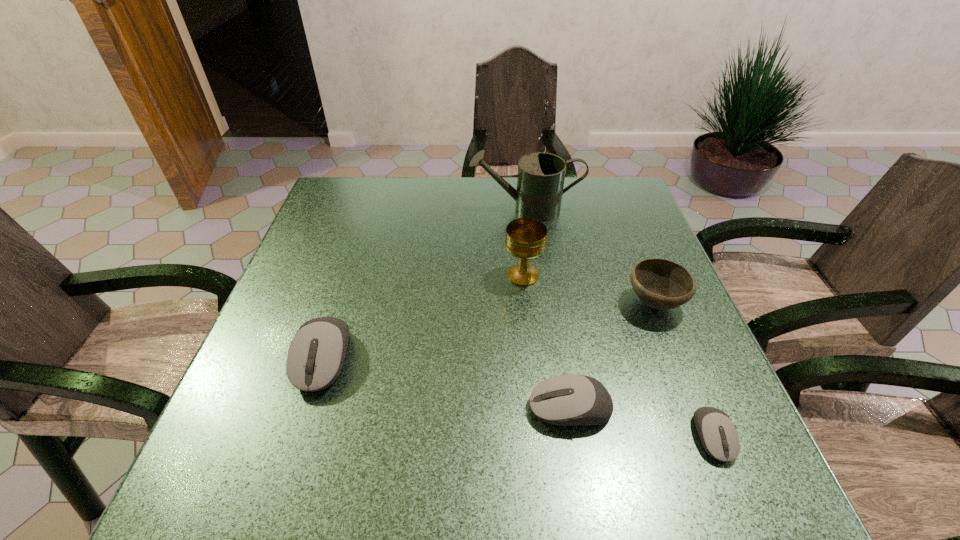
Locate an element on the screen. The width and height of the screenshot is (960, 540). object identified as the closest to the bowl is located at coordinates (567, 400).

The width and height of the screenshot is (960, 540). What are the coordinates of `object that can be found as the closest to the fourth shortest object` in the screenshot? It's located at (567, 400).

Identify the location of computer equipment that stands as the third closest to the second tallest object. (718, 435).

Point out which computer equipment is positioned as the third nearest to the chalice. Please provide its 2D coordinates. Your answer should be formatted as a tuple, i.e. [(x, y)], where the tuple contains the x and y coordinates of a point satisfying the conditions above.

[(718, 435)]

You are a GUI agent. You are given a task and a screenshot of the screen. Output one action in this format:
    pyautogui.click(x=<x>, y=<y>)
    Task: Click on the free space that satisfies the following two spatial constraints: 1. with the spout on the watering can; 2. on the left side of the bowl
    The image size is (960, 540).
    Given the screenshot: What is the action you would take?
    pyautogui.click(x=538, y=303)

Where is `vacant space that satisfies the following two spatial constraints: 1. on the front side of the second tallest object; 2. on the right side of the bowl`? The image size is (960, 540). vacant space that satisfies the following two spatial constraints: 1. on the front side of the second tallest object; 2. on the right side of the bowl is located at coordinates (526, 303).